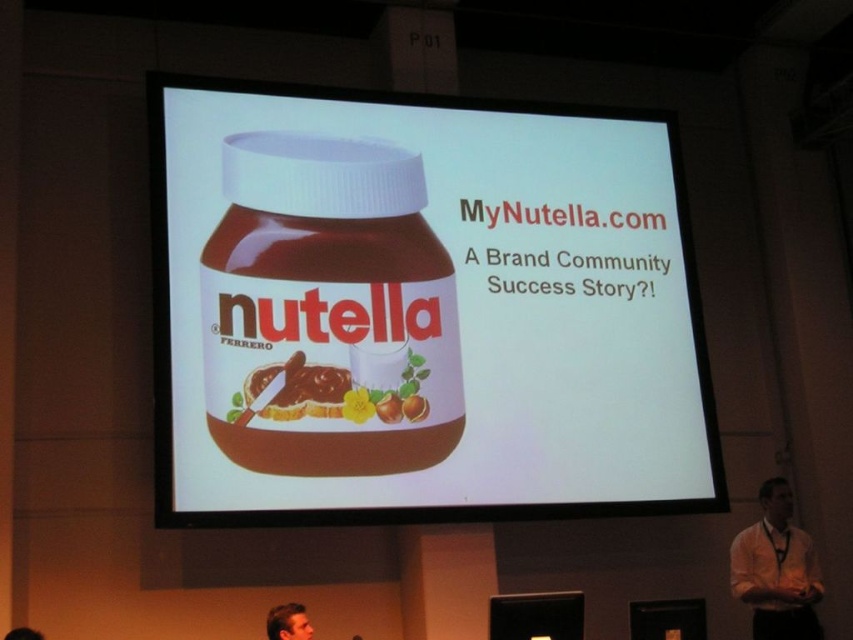
You are a photographer in a conference room preparing to take a closeup shot of the MyNutella.com presentation slide. You notice the white shirt at lower right and the smooth skin face at lower center in your viewfinder. Which object should you focus on to ensure the larger one is in sharp focus?

The white shirt at lower right is larger in size than the smooth skin face at lower center, so you should focus on the white shirt at lower right to ensure the larger one is in sharp focus.

You are an assistant organizing a presentation. You need to ensure that the matte plastic jar of nutella at center and the smooth skin face at lower center are visible to the audience. Considering their sizes, which object might be more challenging to see from the back of the room?

The smooth skin face at lower center might be more challenging to see from the back of the room because the matte plastic jar of nutella at center is taller than it.

You are an attendee at the presentation and want to know if the white shirt at lower right can fully cover the smooth skin face at lower center. Based on the scene description, can it?

The white shirt at lower right is wider than the smooth skin face at lower center, so yes, the white shirt at lower right can fully cover the smooth skin face at lower center.